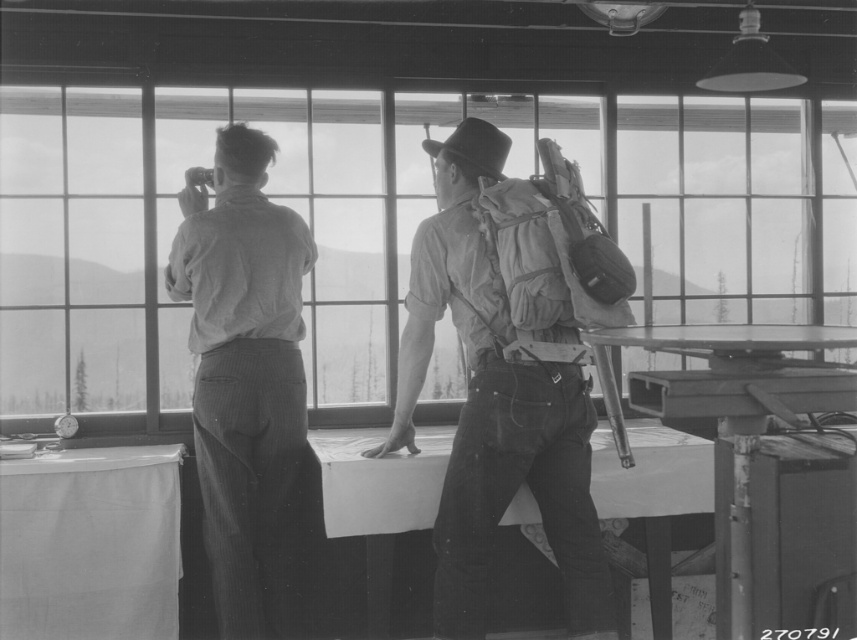
Who is more forward, (34, 561) or (686, 342)?

Point (686, 342) is more forward.

Is white fabric table at lower left to the left of metallic gray table at right from the viewer's perspective?

Indeed, white fabric table at lower left is positioned on the left side of metallic gray table at right.

Where is `white fabric table at lower left`? white fabric table at lower left is located at coordinates (90, 545).

Identify the location of white fabric table at lower left. This screenshot has height=640, width=857. (90, 545).

Does point (406, 515) lie in front of point (478, 116)?

Yes, it is in front of point (478, 116).

Locate an element on the screen. smooth wood table at center is located at coordinates (379, 481).

Is point (388, 502) positioned behind point (436, 150)?

Yes, point (388, 502) is farther from viewer.

Find the location of `smooth wood table at center`. smooth wood table at center is located at coordinates (379, 481).

Between smooth gray shirt at left and white fabric table at lower left, which one is positioned higher?

smooth gray shirt at left

From the picture: Is smooth gray shirt at left in front of white fabric table at lower left?

Yes, it is.

Find the location of a particular element. This screenshot has width=857, height=640. smooth gray shirt at left is located at coordinates [244, 378].

The height and width of the screenshot is (640, 857). In order to click on smooth gray shirt at left in this screenshot , I will do `click(244, 378)`.